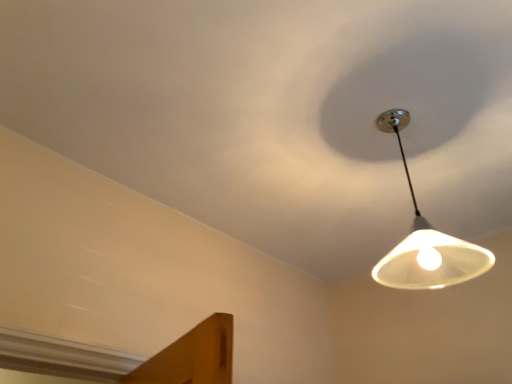
What do you see at coordinates (426, 241) in the screenshot?
I see `white matte lampshade at upper right` at bounding box center [426, 241].

The height and width of the screenshot is (384, 512). I want to click on white matte lampshade at upper right, so click(x=426, y=241).

This screenshot has width=512, height=384. I want to click on white matte light fixture at upper right, so click(x=276, y=113).

Describe the element at coordinates (276, 113) in the screenshot. The image size is (512, 384). I see `white matte light fixture at upper right` at that location.

In order to face white matte light fixture at upper right, should I rotate leftwards or rightwards?

A 9.074 degree turn to the right will do.

I want to click on white matte lampshade at upper right, so click(x=426, y=241).

Which is more to the left, white matte lampshade at upper right or white matte light fixture at upper right?

white matte light fixture at upper right.

Is white matte lampshade at upper right in front of or behind white matte light fixture at upper right in the image?

Clearly, white matte lampshade at upper right is behind white matte light fixture at upper right.

Is point (435, 238) farther from camera compared to point (353, 212)?

No, (435, 238) is in front of (353, 212).

From the image's perspective, is white matte lampshade at upper right below white matte light fixture at upper right?

Indeed, from the image's perspective, white matte lampshade at upper right is shown beneath white matte light fixture at upper right.

From a real-world perspective, which object rests below the other?

white matte lampshade at upper right is physically lower.

Looking at their sizes, would you say white matte lampshade at upper right is wider or thinner than white matte light fixture at upper right?

Considering their sizes, white matte lampshade at upper right looks slimmer than white matte light fixture at upper right.

Considering the sizes of objects white matte lampshade at upper right and white matte light fixture at upper right in the image provided, who is shorter, white matte lampshade at upper right or white matte light fixture at upper right?

Standing shorter between the two is white matte light fixture at upper right.

Considering the sizes of white matte lampshade at upper right and white matte light fixture at upper right in the image, is white matte lampshade at upper right bigger or smaller than white matte light fixture at upper right?

white matte lampshade at upper right is smaller than white matte light fixture at upper right.

Is white matte light fixture at upper right surrounded by white matte lampshade at upper right?

Definitely not — white matte light fixture at upper right is not inside white matte lampshade at upper right.

From the picture: Would you say white matte lampshade at upper right is a long distance from white matte light fixture at upper right?

That's not correct — white matte lampshade at upper right is a little close to white matte light fixture at upper right.

Is white matte lampshade at upper right facing away from white matte light fixture at upper right?

No, white matte lampshade at upper right is not facing away from white matte light fixture at upper right.

Can you tell me how much white matte lampshade at upper right and white matte light fixture at upper right differ in facing direction?

The facing directions of white matte lampshade at upper right and white matte light fixture at upper right are 90.8 degrees apart.

Locate an element on the screen. lamp that appears below the white matte light fixture at upper right (from the image's perspective) is located at coordinates (426, 241).

Considering the positions of objects white matte light fixture at upper right and white matte lampshade at upper right in the image provided, who is more to the right, white matte light fixture at upper right or white matte lampshade at upper right?

From the viewer's perspective, white matte lampshade at upper right appears more on the right side.

Is white matte light fixture at upper right in front of or behind white matte lampshade at upper right in the image?

In the image, white matte light fixture at upper right appears in front of white matte lampshade at upper right.

Which is less distant, (115, 131) or (374, 276)?

Point (115, 131) is farther from the camera than point (374, 276).

From the image's perspective, relative to white matte lampshade at upper right, is white matte light fixture at upper right above or below?

From the image's perspective, white matte light fixture at upper right appears above white matte lampshade at upper right.

From a real-world perspective, which is physically below, white matte light fixture at upper right or white matte lampshade at upper right?

From a 3D spatial view, white matte lampshade at upper right is below.

Looking at their sizes, would you say white matte light fixture at upper right is wider or thinner than white matte lampshade at upper right?

white matte light fixture at upper right is wider than white matte lampshade at upper right.

In the scene shown: Who is taller, white matte light fixture at upper right or white matte lampshade at upper right?

Standing taller between the two is white matte lampshade at upper right.

Can you confirm if white matte light fixture at upper right is bigger than white matte lampshade at upper right?

Indeed, white matte light fixture at upper right has a larger size compared to white matte lampshade at upper right.

Is white matte lampshade at upper right completely or partially inside white matte light fixture at upper right?

No, white matte light fixture at upper right does not contain white matte lampshade at upper right.

Would you say white matte light fixture at upper right is a long distance from white matte lampshade at upper right?

No, white matte light fixture at upper right is not far away from white matte lampshade at upper right.

Is white matte light fixture at upper right positioned with its back to white matte lampshade at upper right?

No, white matte light fixture at upper right's orientation is not away from white matte lampshade at upper right.

How many degrees apart are the facing directions of white matte light fixture at upper right and white matte lampshade at upper right?

The angle between the facing direction of white matte light fixture at upper right and the facing direction of white matte lampshade at upper right is 90.8 degrees.

Where is `lamp below the white matte light fixture at upper right (from the image's perspective)`? lamp below the white matte light fixture at upper right (from the image's perspective) is located at coordinates (426, 241).

Where is `cloud that appears above the white matte lampshade at upper right (from the image's perspective)`? This screenshot has height=384, width=512. cloud that appears above the white matte lampshade at upper right (from the image's perspective) is located at coordinates (276, 113).

The width and height of the screenshot is (512, 384). Find the location of `lamp behind the white matte light fixture at upper right`. lamp behind the white matte light fixture at upper right is located at coordinates (426, 241).